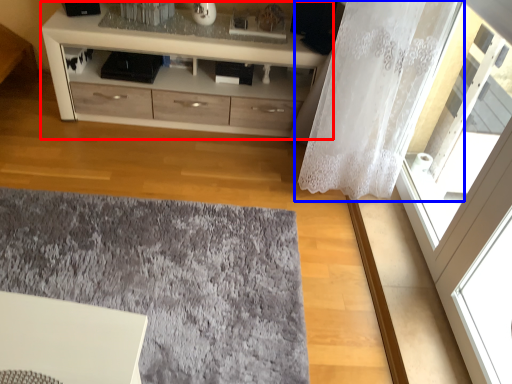
Question: Among these objects, which one is farthest to the camera, chest of drawers (highlighted by a red box) or curtain (highlighted by a blue box)?

Choices:
 (A) chest of drawers
 (B) curtain

Answer: (A)